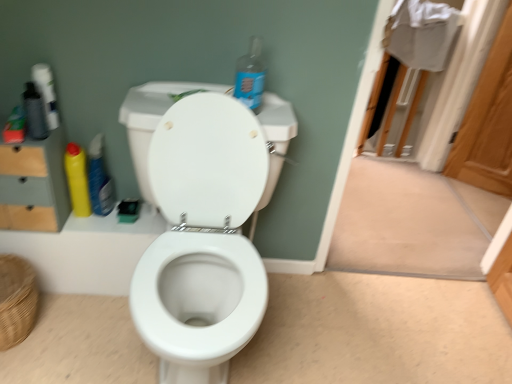
Question: Considering the positions of woven brown basket at lower left and yellow matte bottle at left, the third cleaning product from the right, in the image, is woven brown basket at lower left bigger or smaller than yellow matte bottle at left, the third cleaning product from the right,?

Choices:
 (A) small
 (B) big

Answer: (B)

Question: Choose the correct answer: Is woven brown basket at lower left inside yellow matte bottle at left, the third cleaning product from the right, or outside it?

Choices:
 (A) outside
 (B) inside

Answer: (A)

Question: Which of these objects is positioned closest to the yellow matte bottle at left, the third cleaning product from the right?

Choices:
 (A) blue plastic bottle at upper center, which appears as the first cleaning product when viewed from the right
 (B) woven brown basket at lower left
 (C) white glossy toilet at center
 (D) wooden screen door at upper right
 (E) yellow plastic bottle at left, marked as the 2th cleaning product in a right-to-left arrangement

Answer: (E)

Question: Estimate the real-world distances between objects in this image. Which object is farther from the yellow matte bottle at left, which ranks as the 1th cleaning product in left-to-right order?

Choices:
 (A) woven brown basket at lower left
 (B) wooden dresser at left
 (C) white glossy toilet at center
 (D) yellow plastic bottle at left, marked as the 2th cleaning product in a right-to-left arrangement
 (E) wooden screen door at upper right

Answer: (E)